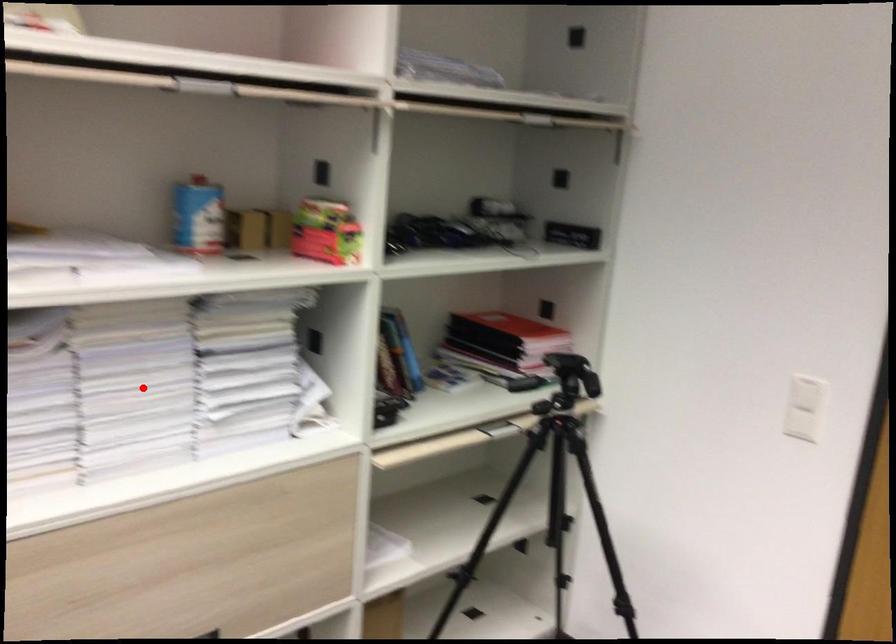
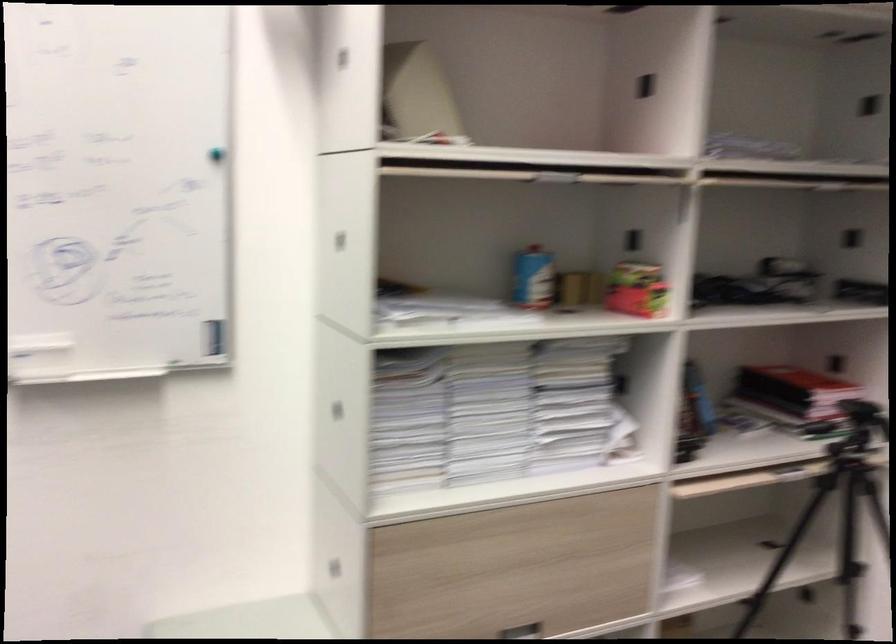
Question: A red point is marked in image1. In image2, is the corresponding 3D point closer to the camera or farther? Reply with the corresponding letter.

Choices:
 (A) The corresponding 3D point is closer.
 (B) The corresponding 3D point is farther.

Answer: (B)